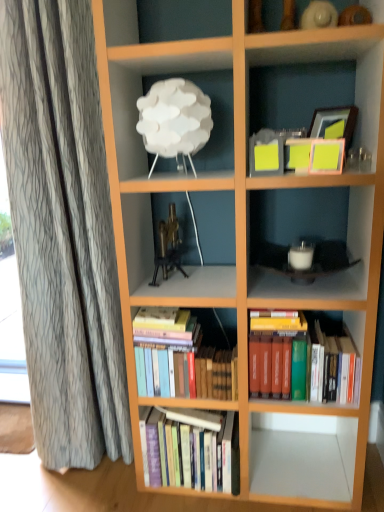
Question: Is hardcover books at center, which is the first book in bottom-to-top order, in front of or behind white matte lamp at upper left in the image?

Choices:
 (A) behind
 (B) front

Answer: (A)

Question: Is hardcover books at center, which is the first book in bottom-to-top order, bigger or smaller than white matte lamp at upper left?

Choices:
 (A) small
 (B) big

Answer: (B)

Question: Which object is the farthest from the hardcover books at center, which is counted as the first book, starting from the top?

Choices:
 (A) white matte lamp at upper left
 (B) gold metallic tripod at center
 (C) hardcover books at center, marked as the third book in a top-to-bottom arrangement
 (D) hardcover books at center, arranged as the second book when viewed from the top
 (E) wooden picture frame at upper right

Answer: (A)

Question: Which of these objects is positioned farthest from the hardcover books at center, arranged as the second book when viewed from the top?

Choices:
 (A) gold metallic tripod at center
 (B) hardcover books at center, which is the first book in bottom-to-top order
 (C) hardcover books at center, which is counted as the first book, starting from the top
 (D) white matte lamp at upper left
 (E) wooden picture frame at upper right

Answer: (E)